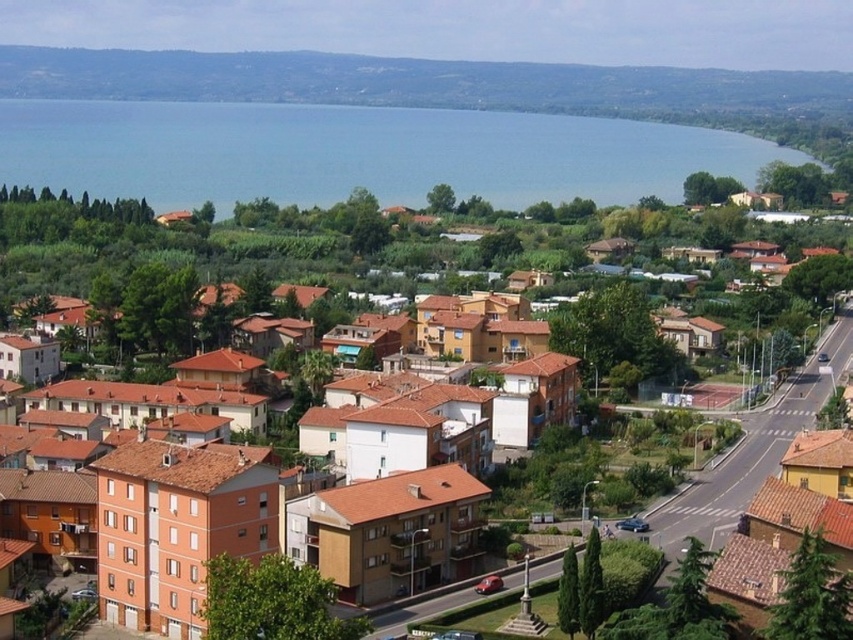
Looking at this image, does blue water at center lie behind brown brick houses at center?

Yes, it is.

Is blue water at center to the left of brown brick houses at center from the viewer's perspective?

Indeed, blue water at center is positioned on the left side of brown brick houses at center.

The width and height of the screenshot is (853, 640). What do you see at coordinates (357, 154) in the screenshot?
I see `blue water at center` at bounding box center [357, 154].

You are a GUI agent. You are given a task and a screenshot of the screen. Output one action in this format:
    pyautogui.click(x=<x>, y=<y>)
    Task: Click on the blue water at center
    This screenshot has width=853, height=640.
    Given the screenshot: What is the action you would take?
    pyautogui.click(x=357, y=154)